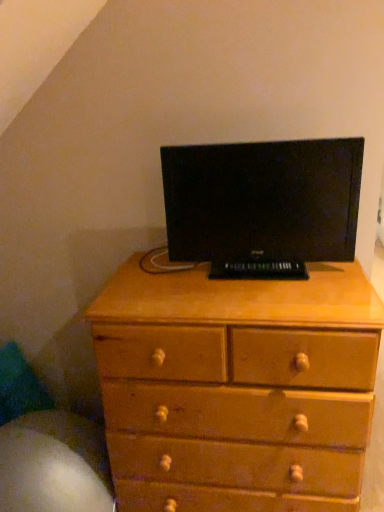
At what (x,y) coordinates should I click in order to perform the action: click on vacant space situated above light brown wood chest of drawers at center (from a real-world perspective). Please return your answer as a coordinate pair (x, y). Looking at the image, I should click on (198, 282).